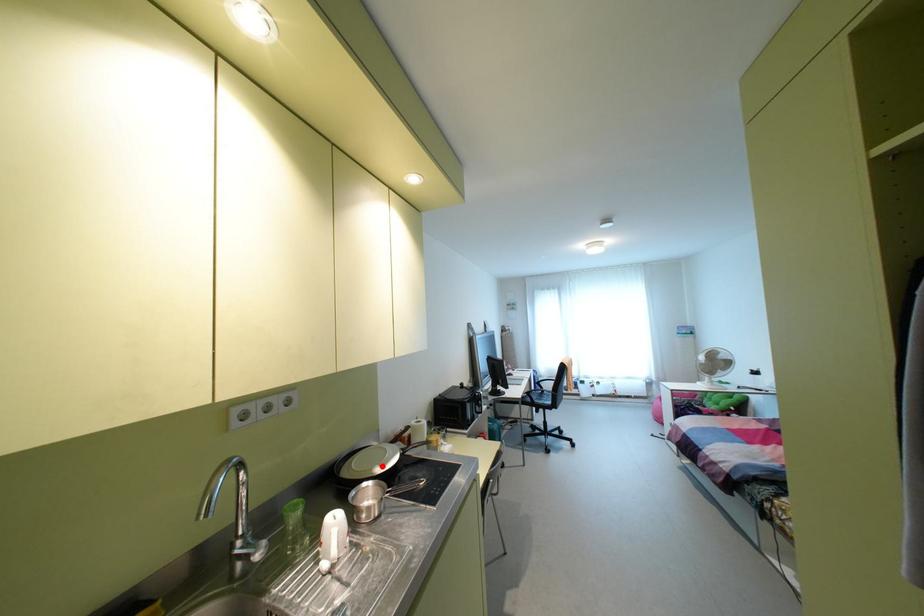
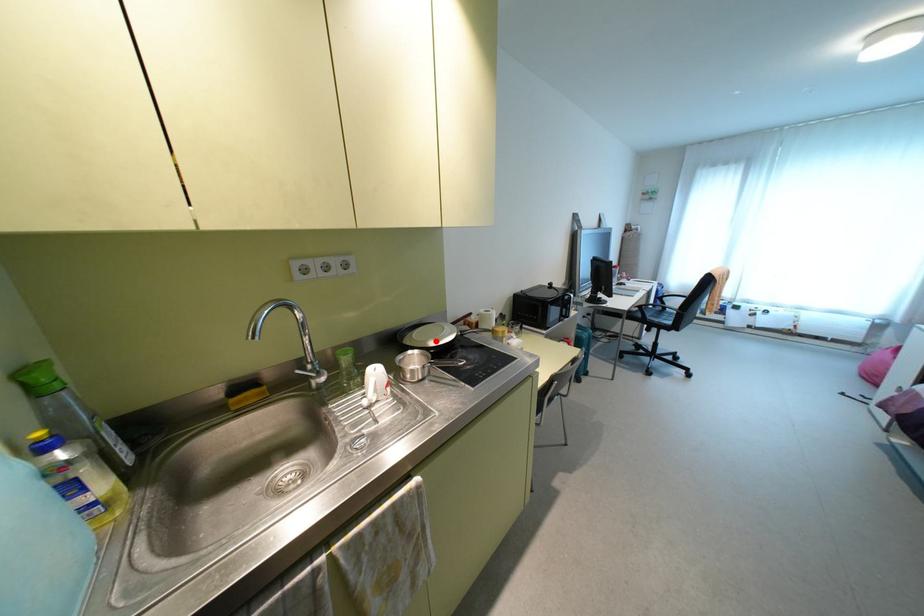
I am providing you with two images of the same scene from different viewpoints. A red point is marked on the first image and another point is marked on the second image. Does the point marked in image1 correspond to the same location as the one in image2?

Yes